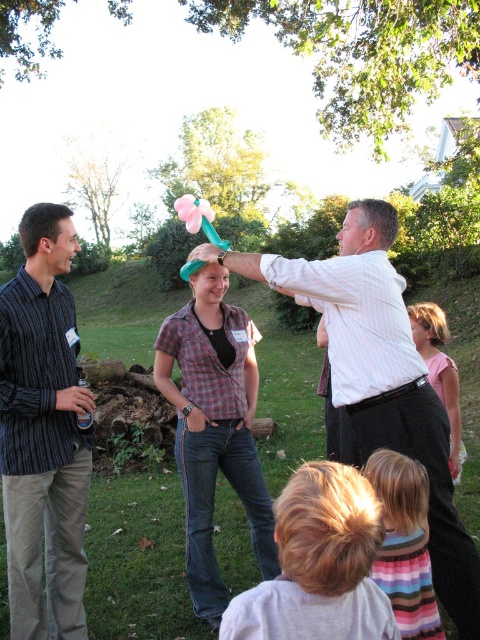
Which of these two, plaid shirt at center or cotton candy at center, stands shorter?

Standing shorter between the two is plaid shirt at center.

Does plaid shirt at center have a larger size compared to cotton candy at center?

No, plaid shirt at center is not bigger than cotton candy at center.

Between point (192, 406) and point (188, 218), which one is positioned in front?

Point (192, 406) is more forward.

Where is `plaid shirt at center`? This screenshot has width=480, height=640. plaid shirt at center is located at coordinates (215, 428).

Between white striped shirt at center and cotton candy at center, which one is positioned higher?

cotton candy at center is above.

Can you confirm if white striped shirt at center is positioned to the left of cotton candy at center?

Incorrect, white striped shirt at center is not on the left side of cotton candy at center.

At what (x,y) coordinates should I click in order to perform the action: click on white striped shirt at center. Please return your answer as a coordinate pair (x, y). The image size is (480, 640). Looking at the image, I should click on (379, 378).

Who is positioned more to the left, pink fabric dress at lower right or cotton candy at center?

Positioned to the left is cotton candy at center.

Is point (447, 404) farther from camera compared to point (190, 218)?

Yes.

Is point (414, 328) behind point (193, 204)?

Yes, point (414, 328) is behind point (193, 204).

Find the location of a particular element. Image resolution: width=480 pixels, height=640 pixels. pink fabric dress at lower right is located at coordinates (440, 372).